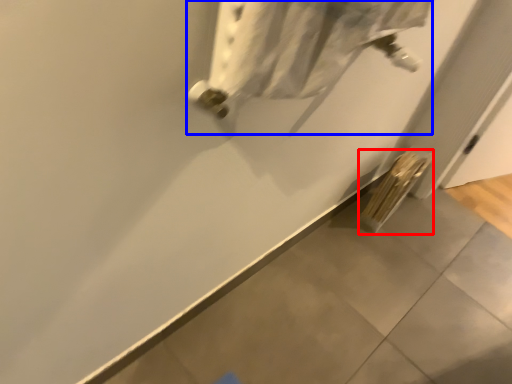
Question: Which object appears farthest to the camera in this image, radiator (highlighted by a red box) or wide (highlighted by a blue box)?

Choices:
 (A) radiator
 (B) wide

Answer: (A)